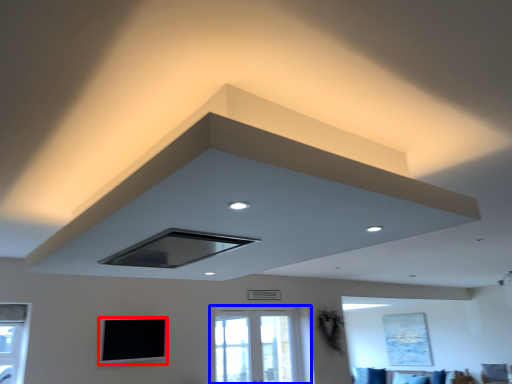
Question: Which object is further to the camera taking this photo, window screen (highlighted by a red box) or window (highlighted by a blue box)?

Choices:
 (A) window screen
 (B) window

Answer: (B)